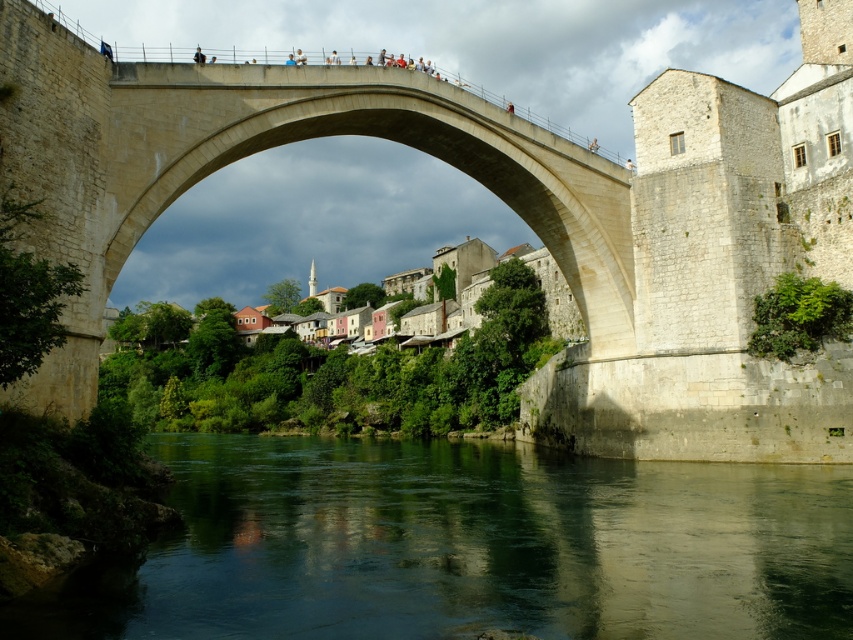
Question: Is green smooth water at lower center smaller than beige stone bridge at center?

Choices:
 (A) no
 (B) yes

Answer: (B)

Question: Where is green smooth water at lower center located in relation to beige stone bridge at center in the image?

Choices:
 (A) above
 (B) below

Answer: (B)

Question: Which of the following is the closest to the observer?

Choices:
 (A) (86, 241)
 (B) (341, 532)

Answer: (B)

Question: Which object is closer to the camera taking this photo?

Choices:
 (A) green smooth water at lower center
 (B) beige stone bridge at center

Answer: (A)

Question: Can you confirm if green smooth water at lower center is wider than beige stone bridge at center?

Choices:
 (A) no
 (B) yes

Answer: (B)